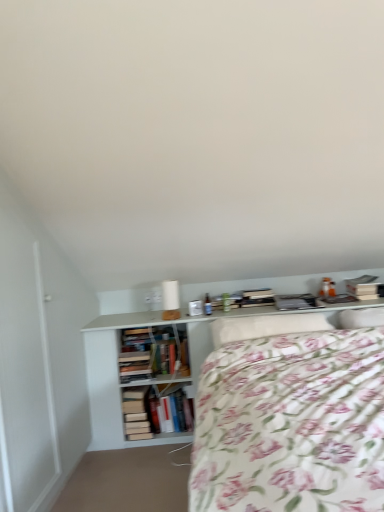
Question: Is white soft pillow at upper right positioned with its back to hardcover books at center?

Choices:
 (A) yes
 (B) no

Answer: (B)

Question: Can you confirm if white soft pillow at upper right is taller than hardcover books at center?

Choices:
 (A) no
 (B) yes

Answer: (A)

Question: Does white soft pillow at upper right appear on the left side of hardcover books at center?

Choices:
 (A) yes
 (B) no

Answer: (B)

Question: Considering the relative sizes of white soft pillow at upper right and hardcover books at center in the image provided, is white soft pillow at upper right bigger than hardcover books at center?

Choices:
 (A) no
 (B) yes

Answer: (A)

Question: Is white soft pillow at upper right smaller than hardcover books at center?

Choices:
 (A) no
 (B) yes

Answer: (B)

Question: Could you tell me if white soft pillow at upper right is turned towards hardcover books at center?

Choices:
 (A) yes
 (B) no

Answer: (B)

Question: From a real-world perspective, is hardcover books at center over white soft pillow at upper right?

Choices:
 (A) no
 (B) yes

Answer: (A)

Question: From the image's perspective, does hardcover books at center appear lower than white soft pillow at upper right?

Choices:
 (A) yes
 (B) no

Answer: (A)

Question: Is there a large distance between hardcover books at center and white soft pillow at upper right?

Choices:
 (A) no
 (B) yes

Answer: (B)

Question: Can you confirm if hardcover books at center is positioned to the right of white soft pillow at upper right?

Choices:
 (A) no
 (B) yes

Answer: (A)

Question: Does hardcover books at center have a greater width compared to white soft pillow at upper right?

Choices:
 (A) yes
 (B) no

Answer: (B)

Question: Is hardcover books at center at the left side of white soft pillow at upper right?

Choices:
 (A) yes
 (B) no

Answer: (A)

Question: Considering the relative sizes of hardcover books at center and white matte shelf at center in the image provided, is hardcover books at center thinner than white matte shelf at center?

Choices:
 (A) yes
 (B) no

Answer: (A)